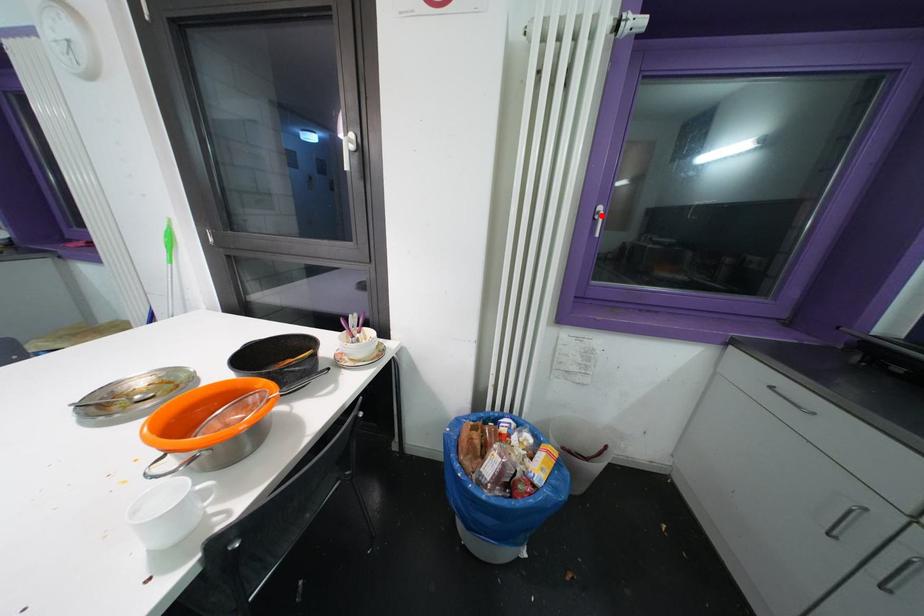
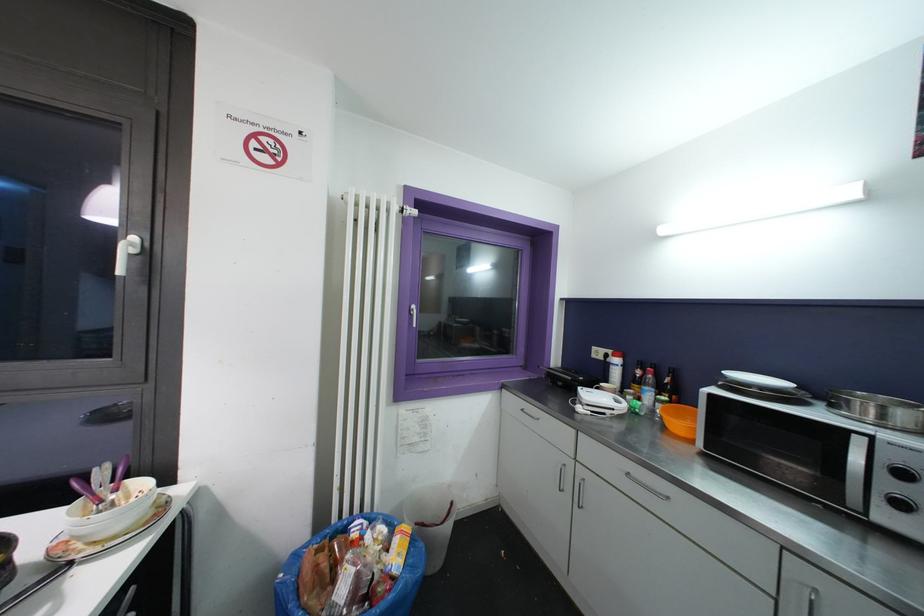
Find the pixel in the second image that matches the highlighted location in the first image.

(416, 313)